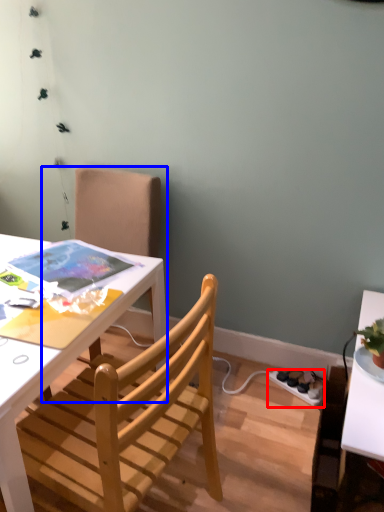
Question: Which point is closer to the camera, power outlet (highlighted by a red box) or chair (highlighted by a blue box)?

Choices:
 (A) power outlet
 (B) chair

Answer: (B)